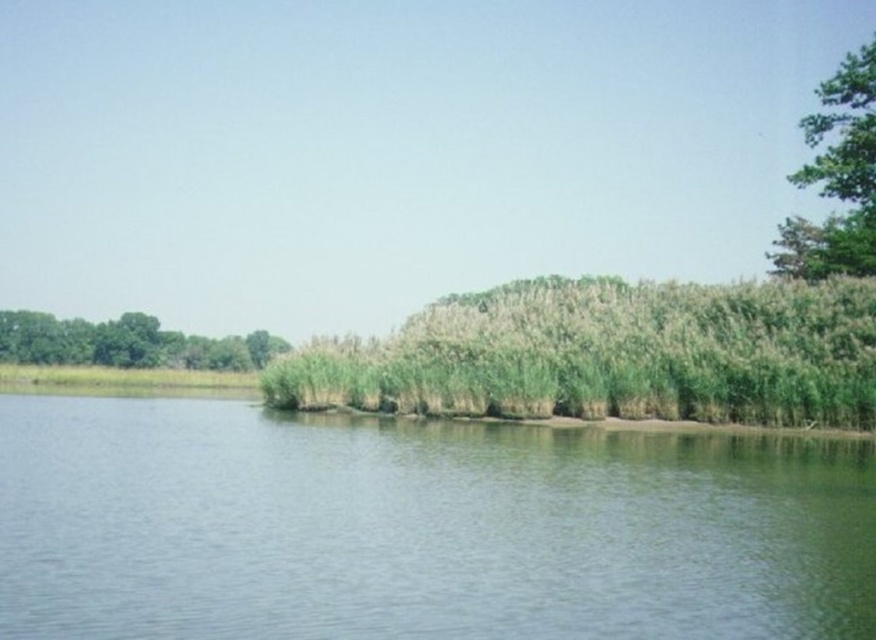
Is green grassy river at center wider than green leafy tree at upper right?

No, green grassy river at center is not wider than green leafy tree at upper right.

Is green grassy river at center closer to camera compared to green leafy tree at upper right?

Yes, it is in front of green leafy tree at upper right.

Find the location of a particular element. This screenshot has height=640, width=876. green grassy river at center is located at coordinates (419, 528).

This screenshot has height=640, width=876. Identify the location of green grassy river at center. (419, 528).

Between point (869, 202) and point (170, 365), which one is positioned behind?

The point (170, 365) is more distant.

Can you confirm if green leafy tree at upper right is thinner than green leafy trees at left?

In fact, green leafy tree at upper right might be wider than green leafy trees at left.

Image resolution: width=876 pixels, height=640 pixels. Find the location of `green leafy tree at upper right`. green leafy tree at upper right is located at coordinates (836, 177).

Does green grassy river at center appear under green leafy trees at left?

Correct, green grassy river at center is located below green leafy trees at left.

Is green grassy river at center bigger than green leafy trees at left?

Actually, green grassy river at center might be smaller than green leafy trees at left.

Which is in front, point (373, 605) or point (0, 324)?

Point (373, 605) is in front.

You are a GUI agent. You are given a task and a screenshot of the screen. Output one action in this format:
    pyautogui.click(x=<x>, y=<y>)
    Task: Click on the green grassy river at center
    The height and width of the screenshot is (640, 876).
    Given the screenshot: What is the action you would take?
    pyautogui.click(x=419, y=528)